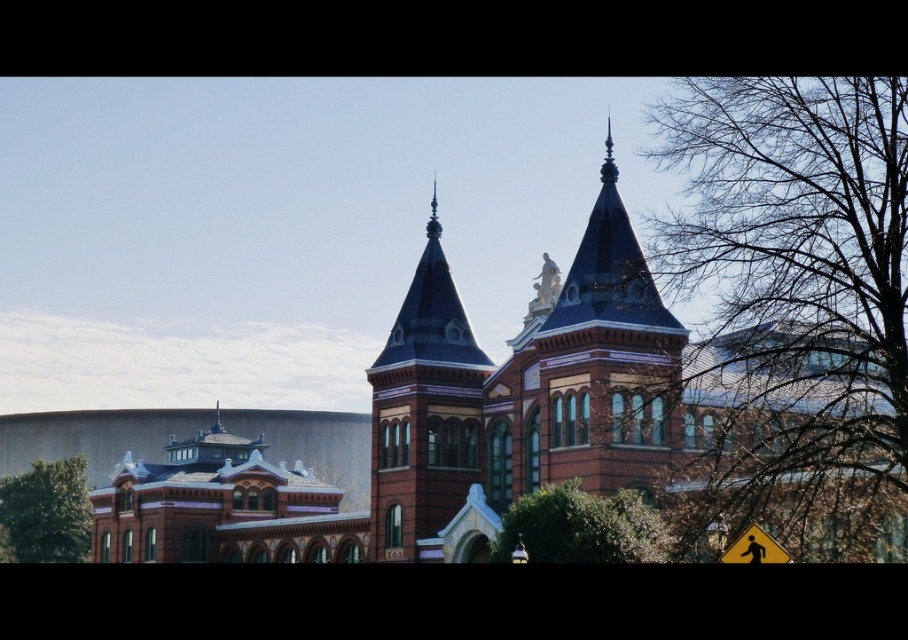
You are standing in front of the historic building and want to cross the street safely. You see the green leafy tree at lower left and the yellow reflective plastic pedestrian crossing sign at lower right. Which object is closer to the ground?

The green leafy tree at lower left is located below the yellow reflective plastic pedestrian crossing sign at lower right, so the green leafy tree at lower left is closer to the ground.

You are a photographer standing at the base of the historic building. You want to capture a closeup shot of the shiny dark blue spire at center. Given that your camera can focus on objects up to 100 meters away, will you be able to take the photo without moving closer?

The shiny dark blue spire at center is 84.59 meters away from the camera. Since your camera can focus up to 100 meters, you can take the photo without moving closer.

You are standing at the center of the image. Which direction should you look to see the green leafy tree at lower left?

The green leafy tree at lower left is located at point (45,513), which is in the lower left direction from the center of the image. Therefore, you should look towards the lower left direction to see it.